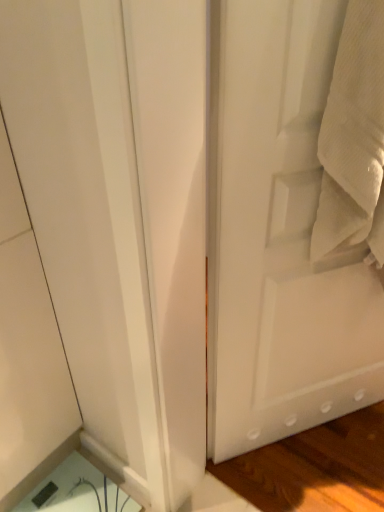
Image resolution: width=384 pixels, height=512 pixels. What do you see at coordinates (279, 234) in the screenshot? I see `white matte door at right` at bounding box center [279, 234].

Image resolution: width=384 pixels, height=512 pixels. In order to click on white matte door at right in this screenshot , I will do `click(279, 234)`.

What do you see at coordinates (354, 138) in the screenshot? I see `white textured towel at right` at bounding box center [354, 138].

Find the location of a particular element. The image size is (384, 512). white textured towel at right is located at coordinates (354, 138).

Where is `white matte door at right`? This screenshot has width=384, height=512. white matte door at right is located at coordinates (279, 234).

Which object is positioned more to the right, white matte door at right or white textured towel at right?

Positioned to the right is white matte door at right.

Does white matte door at right lie behind white textured towel at right?

Yes, it is.

Which point is more forward, (282,376) or (316,234)?

The point (316,234) is more forward.

From the image's perspective, which one is positioned lower, white matte door at right or white textured towel at right?

white matte door at right.

From a real-world perspective, is white matte door at right on top of white textured towel at right?

No.

Considering the sizes of white matte door at right and white textured towel at right in the image, is white matte door at right wider or thinner than white textured towel at right?

In the image, white matte door at right appears to be more narrow than white textured towel at right.

Between white matte door at right and white textured towel at right, which one has more height?

white matte door at right is taller.

Is white matte door at right smaller than white textured towel at right?

No.

Is white textured towel at right completely or partially inside white matte door at right?

No, white matte door at right does not contain white textured towel at right.

Can you see white matte door at right touching white textured towel at right?

No, white matte door at right is not beside white textured towel at right.

Could you tell me if white matte door at right is facing white textured towel at right?

Yes, white matte door at right is turned towards white textured towel at right.

The image size is (384, 512). I want to click on door that appears on the right of white textured towel at right, so click(279, 234).

Is white textured towel at right to the left of white matte door at right from the viewer's perspective?

Yes, white textured towel at right is to the left of white matte door at right.

In the image, is white textured towel at right positioned in front of or behind white matte door at right?

In the image, white textured towel at right appears in front of white matte door at right.

Is point (333, 109) farther from viewer compared to point (312, 324)?

No, it is in front of (312, 324).

From the image's perspective, which is above, white textured towel at right or white matte door at right?

white textured towel at right, from the image's perspective.

From a real-world perspective, is white textured towel at right over white matte door at right?

Correct, in the physical world, white textured towel at right is higher than white matte door at right.

Considering the sizes of objects white textured towel at right and white matte door at right in the image provided, who is thinner, white textured towel at right or white matte door at right?

white matte door at right.

Between white textured towel at right and white matte door at right, which one has more height?

With more height is white matte door at right.

Who is bigger, white textured towel at right or white matte door at right?

white matte door at right is bigger.

Which is correct: white textured towel at right is inside white matte door at right, or outside of it?

white textured towel at right cannot be found inside white matte door at right.

Is white textured towel at right not close to white matte door at right?

That's not correct — white textured towel at right is a little close to white matte door at right.

Is white matte door at right at the back of white textured towel at right?

Yes, white textured towel at right is facing away from white matte door at right.

Locate an element on the screen. This screenshot has width=384, height=512. bath towel located above the white matte door at right (from the image's perspective) is located at coordinates (354, 138).

At what (x,y) coordinates should I click in order to perform the action: click on door that appears behind the white textured towel at right. Please return your answer as a coordinate pair (x, y). The image size is (384, 512). Looking at the image, I should click on (279, 234).

There is a white matte door at right. Where is `bath towel above it (from a real-world perspective)`? The image size is (384, 512). bath towel above it (from a real-world perspective) is located at coordinates (354, 138).